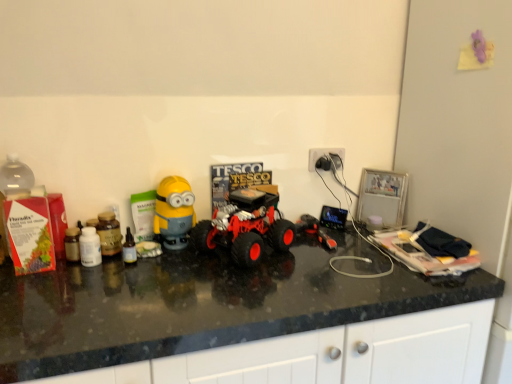
Where is `vacant space to the right of rubberized black toy truck at center, arranged as the 3th toy when viewed from the left`? This screenshot has height=384, width=512. vacant space to the right of rubberized black toy truck at center, arranged as the 3th toy when viewed from the left is located at coordinates (361, 246).